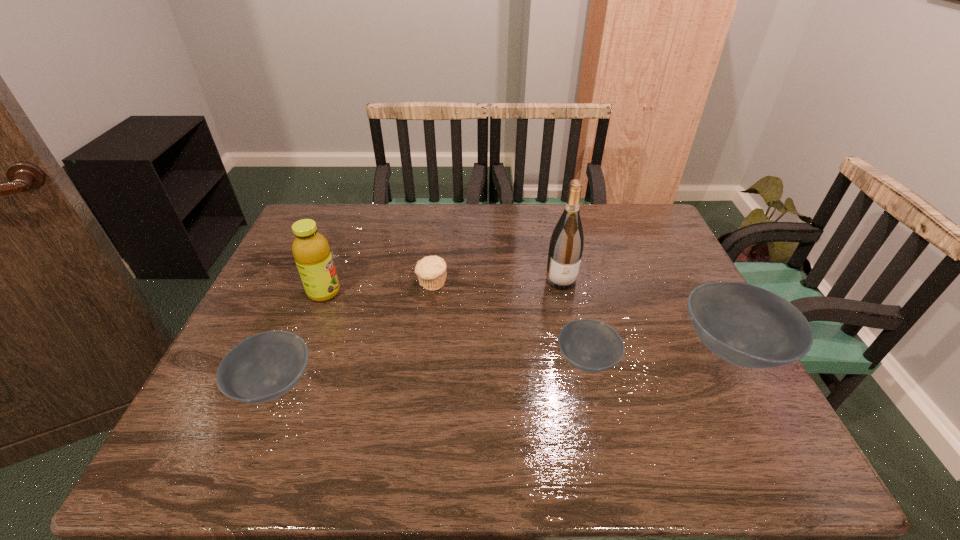
Where is `free space located 0.120m on the left of the rightmost bowl`? free space located 0.120m on the left of the rightmost bowl is located at coordinates (630, 349).

Identify the location of vacant area situated on the front label of the second tallest object. The width and height of the screenshot is (960, 540). (376, 293).

You are a GUI agent. You are given a task and a screenshot of the screen. Output one action in this format:
    pyautogui.click(x=<x>, y=<y>)
    Task: Click on the free space located 0.260m on the front of the fourth object from right to left
    This screenshot has height=540, width=960.
    Given the screenshot: What is the action you would take?
    pyautogui.click(x=421, y=370)

Locate an element on the screen. This screenshot has width=960, height=540. vacant area situated 0.220m on the label of the tallest object is located at coordinates (576, 352).

Where is `bowl that is at the left edge`? This screenshot has height=540, width=960. bowl that is at the left edge is located at coordinates (263, 367).

At what (x,y) coordinates should I click in order to perform the action: click on fruit juice present at the left edge. Please return your answer as a coordinate pair (x, y). The width and height of the screenshot is (960, 540). Looking at the image, I should click on (x=311, y=251).

The width and height of the screenshot is (960, 540). I want to click on object situated at the right edge, so click(x=748, y=326).

Image resolution: width=960 pixels, height=540 pixels. Find the location of `object that is at the near left corner`. object that is at the near left corner is located at coordinates (263, 367).

Locate an element on the screen. Image resolution: width=960 pixels, height=540 pixels. object that is at the near right corner is located at coordinates (748, 326).

In the image, there is a desktop. Where is `vacant space at the far edge`? Image resolution: width=960 pixels, height=540 pixels. vacant space at the far edge is located at coordinates (547, 230).